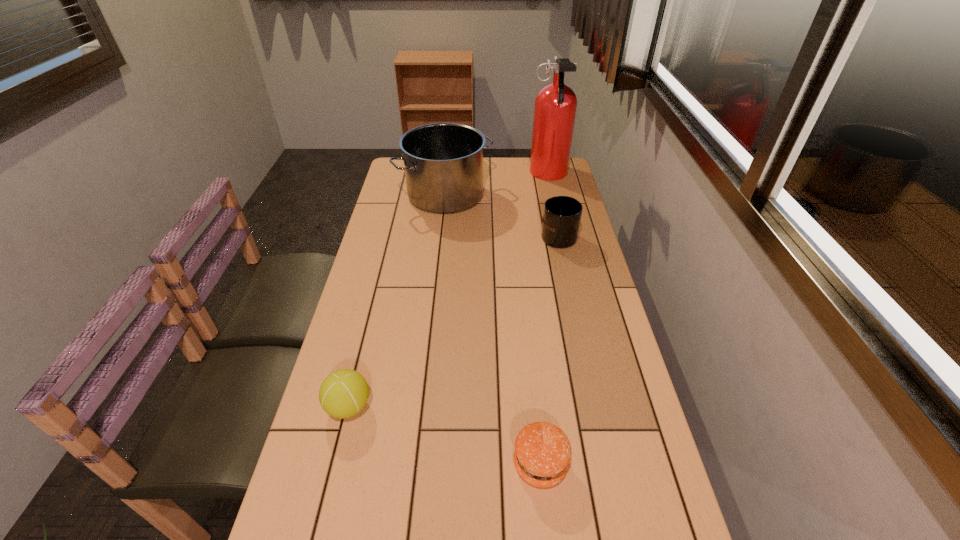
At what (x,y) coordinates should I click in order to perform the action: click on fire extinguisher. Please return your answer as a coordinate pair (x, y). Looking at the image, I should click on (555, 105).

You are a GUI agent. You are given a task and a screenshot of the screen. Output one action in this format:
    pyautogui.click(x=<x>, y=<y>)
    Task: Click on the second tallest object
    The image size is (960, 540).
    Given the screenshot: What is the action you would take?
    pyautogui.click(x=443, y=162)

This screenshot has height=540, width=960. What are the coordinates of `mug` in the screenshot? It's located at (561, 219).

Find the location of a particular element. the third nearest object is located at coordinates (561, 219).

Where is `the second nearest object`? the second nearest object is located at coordinates (343, 393).

Find the location of `the fourth tallest object`. the fourth tallest object is located at coordinates (343, 393).

You are a GUI agent. You are given a task and a screenshot of the screen. Output one action in this format:
    pyautogui.click(x=<x>, y=<y>)
    Task: Click on the third object from left to right
    Image resolution: width=960 pixels, height=540 pixels.
    Given the screenshot: What is the action you would take?
    pyautogui.click(x=542, y=453)

Locate an element on the screen. This screenshot has height=540, width=960. the shortest object is located at coordinates (542, 453).

Identify the location of free space located on the left of the tallest object. The width and height of the screenshot is (960, 540). (457, 175).

At what (x,y) coordinates should I click in order to perform the action: click on vacant space located 0.190m on the front of the fourth shortest object. Please return your answer as a coordinate pair (x, y). The height and width of the screenshot is (540, 960). Looking at the image, I should click on [x=440, y=249].